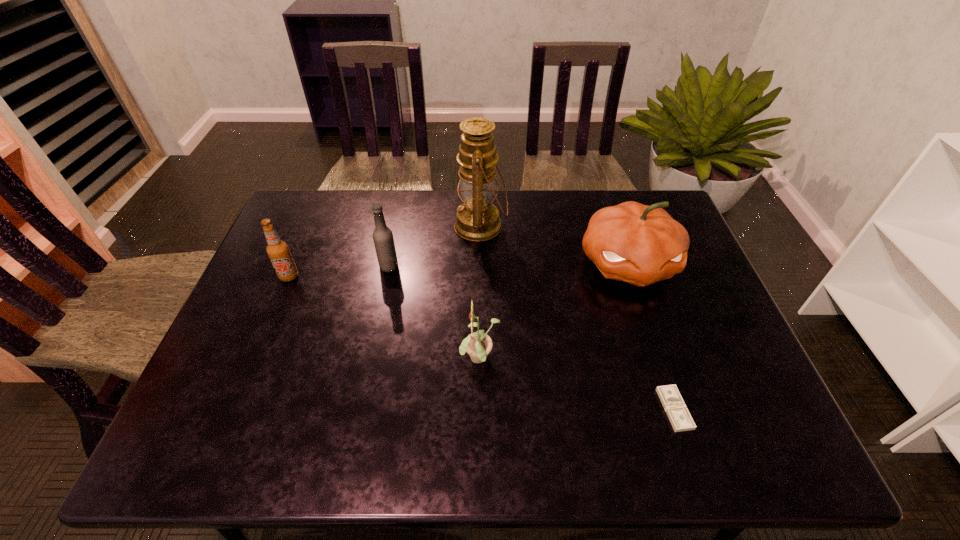
Find the location of a particular element. empty space that is in between the leftmost object and the sunflower is located at coordinates (385, 318).

Locate an element on the screen. The width and height of the screenshot is (960, 540). vacant space in between the oil lamp and the shortest object is located at coordinates (578, 318).

This screenshot has width=960, height=540. What are the coordinates of `free area in between the fifth farthest object and the pumpkin` in the screenshot? It's located at (554, 312).

The image size is (960, 540). Find the location of `empty space that is in between the oil lamp and the pumpkin`. empty space that is in between the oil lamp and the pumpkin is located at coordinates (x=555, y=245).

Locate which object is the third closest to the money. Please provide its 2D coordinates. Your answer should be formatted as a tuple, i.e. [(x, y)], where the tuple contains the x and y coordinates of a point satisfying the conditions above.

[(477, 219)]

I want to click on object that stands as the closest to the left beer bottle, so click(x=383, y=239).

This screenshot has height=540, width=960. In order to click on free space that satisfies the following two spatial constraints: 1. on the front-facing side of the shortest object; 2. on the left side of the second nearest object in this screenshot , I will do (480, 409).

At what (x,y) coordinates should I click in order to perform the action: click on free spot that satisfies the following two spatial constraints: 1. on the front label of the left beer bottle; 2. on the right side of the nearest object. Please return your answer as a coordinate pair (x, y). This screenshot has width=960, height=540. Looking at the image, I should click on (233, 409).

The width and height of the screenshot is (960, 540). I want to click on vacant point that satisfies the following two spatial constraints: 1. on the label of the right beer bottle; 2. on the right side of the shortest object, so click(x=360, y=409).